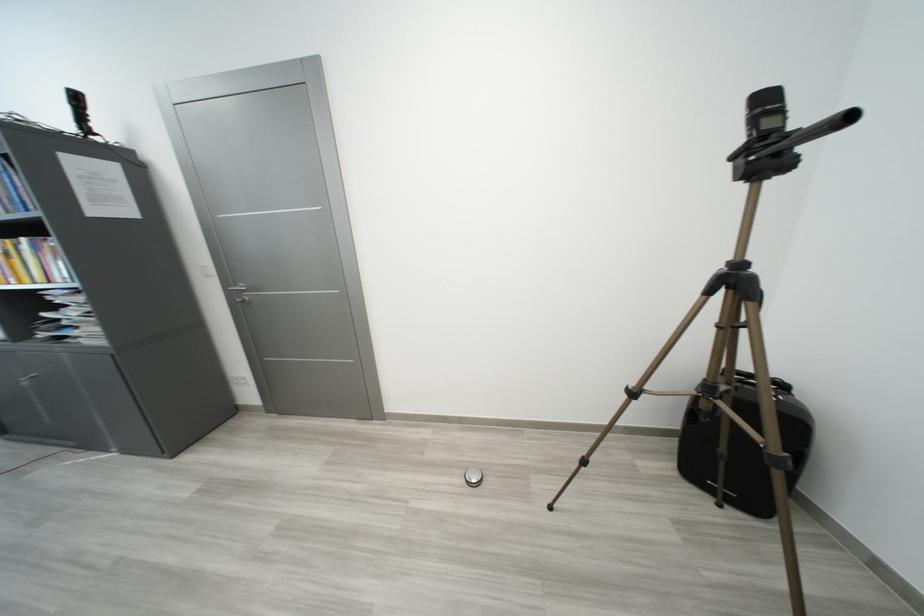
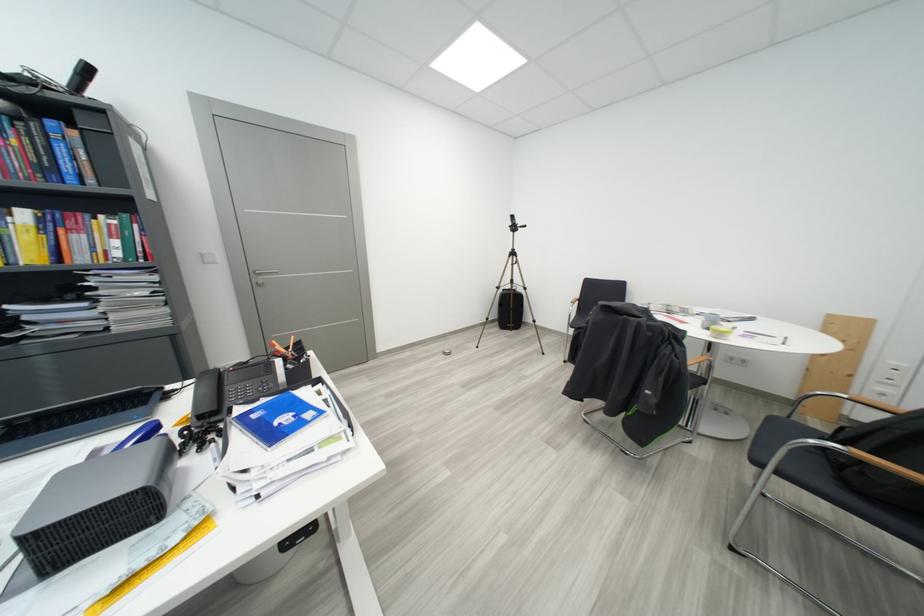
The point at (33,244) is marked in the first image. Where is the corresponding point in the second image?

(32, 216)